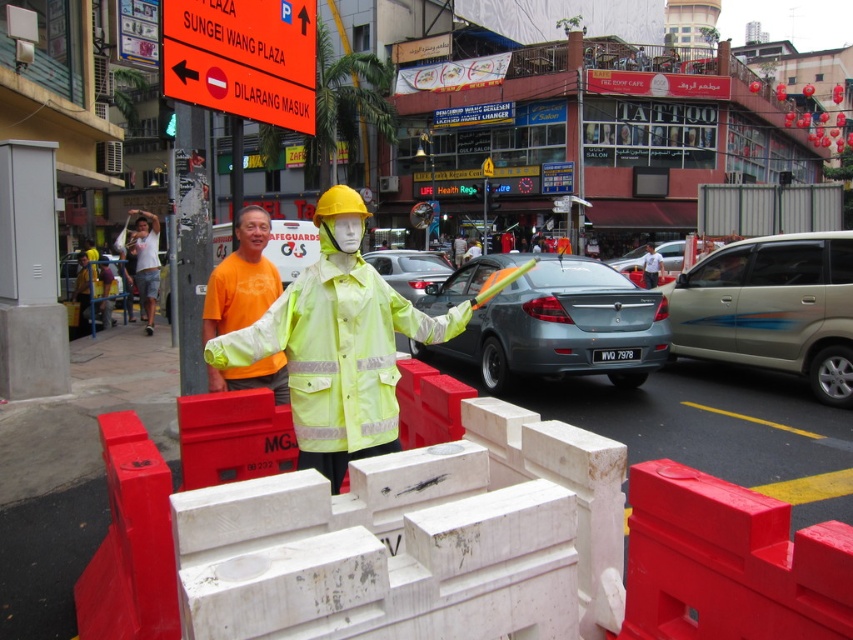
You are a pedestrian trying to cross the street. You see the neon yellow reflective jacket at center and the matte gray sedan at center. Which object is closer to you?

The neon yellow reflective jacket at center is closer to you because it is positioned under the matte gray sedan at center, which implies it is in front of the sedan and thus nearer to your position as a pedestrian.